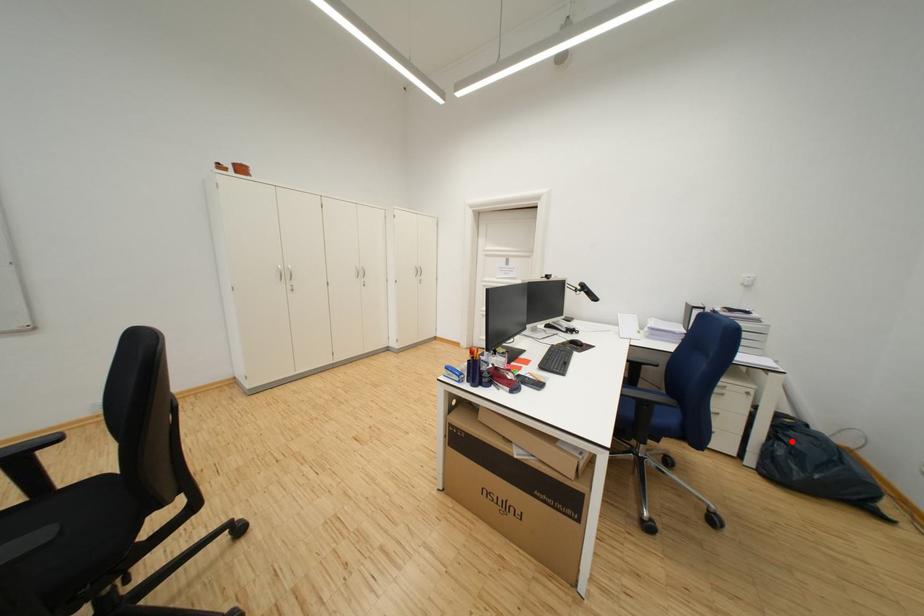
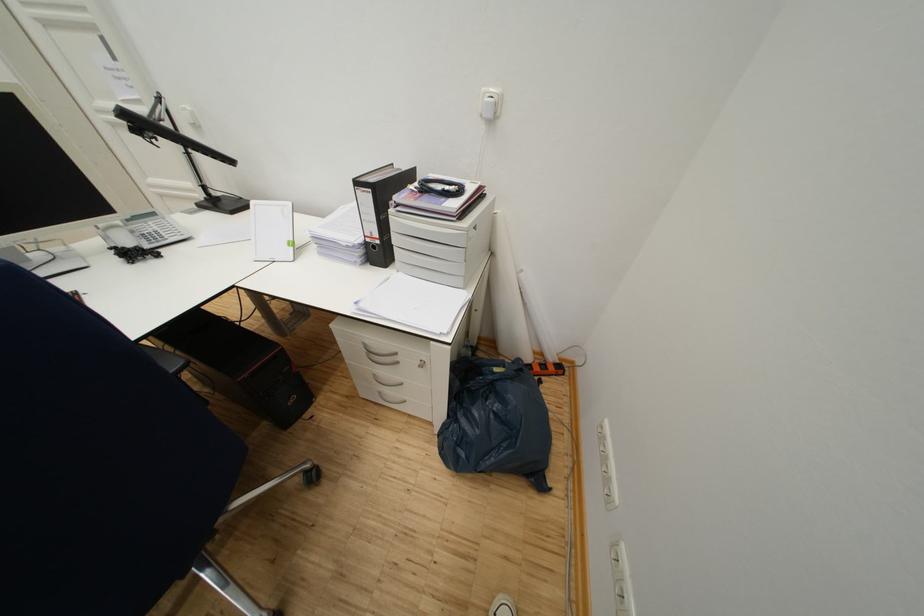
In the second image, find the point that corresponds to the highlighted location in the first image.

(468, 423)